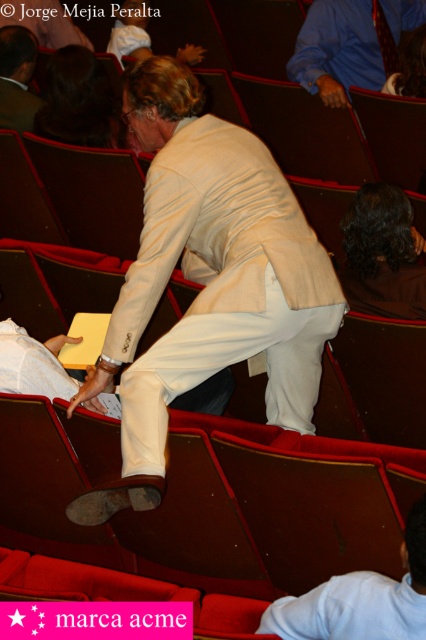
You are an usher at the theater and need to guide the man wearing the matte white suit at center and brown fabric hair at center to his seat. Which object should you point to first to indicate his seat location?

The matte white suit at center is in front of brown fabric hair at center, so you should point to the matte white suit at center first to indicate the seat location.

The man in the image is wearing a matte white suit at center and has brown fabric hair at center. Which of these two items is taller?

The matte white suit at center is much taller than the brown fabric hair at center.